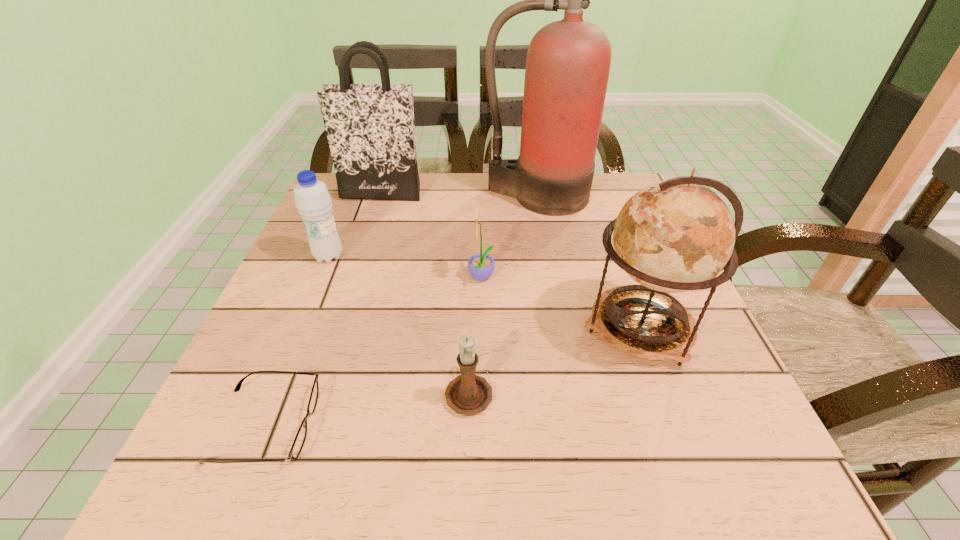
Identify the location of fire extinguisher. (568, 62).

Identify the location of shopping bag. The image size is (960, 540). (370, 128).

In order to click on globe in this screenshot , I will do `click(676, 235)`.

Where is `the fourth tallest object`? the fourth tallest object is located at coordinates (312, 199).

Locate an element on the screen. The width and height of the screenshot is (960, 540). water bottle is located at coordinates (312, 199).

You are a GUI agent. You are given a task and a screenshot of the screen. Output one action in this format:
    pyautogui.click(x=<x>, y=<y>)
    Task: Click on the sunflower
    The height and width of the screenshot is (540, 960).
    Given the screenshot: What is the action you would take?
    pyautogui.click(x=481, y=266)

Image resolution: width=960 pixels, height=540 pixels. Identify the location of the second shortest object. (468, 394).

Locate an element on the screen. The width and height of the screenshot is (960, 540). the shortest object is located at coordinates (300, 437).

Where is `vacant space located 0.230m at the nozzle of the fire extinguisher`? vacant space located 0.230m at the nozzle of the fire extinguisher is located at coordinates (552, 278).

Where is `vacant area situated on the front of the shopping bag with the design`? Image resolution: width=960 pixels, height=540 pixels. vacant area situated on the front of the shopping bag with the design is located at coordinates (372, 221).